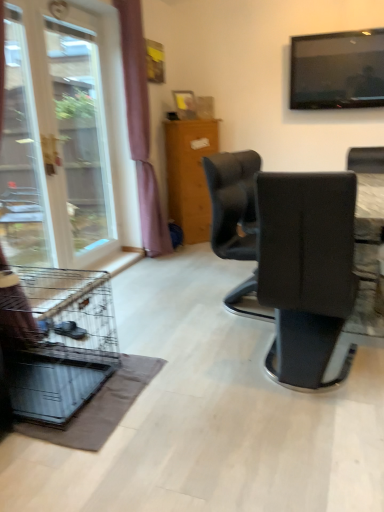
Find the location of `wooden cabinet at center`. wooden cabinet at center is located at coordinates click(x=190, y=175).

Image resolution: width=384 pixels, height=512 pixels. What do you see at coordinates (306, 270) in the screenshot?
I see `black leather chair at center` at bounding box center [306, 270].

Image resolution: width=384 pixels, height=512 pixels. I want to click on transparent glass screen door at left, so click(x=21, y=159).

This screenshot has width=384, height=512. What do you see at coordinates (21, 159) in the screenshot? I see `transparent glass screen door at left` at bounding box center [21, 159].

You are a GUI agent. You are given a task and a screenshot of the screen. Output one action in this format:
    pyautogui.click(x=<x>, y=<y>)
    Task: Click on the transparent glass window at left
    
    Given the screenshot: What is the action you would take?
    pyautogui.click(x=58, y=141)

Where is `purple fabric curtain at left`? purple fabric curtain at left is located at coordinates (141, 128).

What do you see at coordinates (141, 128) in the screenshot? The width and height of the screenshot is (384, 512). I see `purple fabric curtain at left` at bounding box center [141, 128].

This screenshot has height=512, width=384. In order to click on wooden cabinet at center in this screenshot , I will do `click(190, 175)`.

Is wooden cabinet at center to the left or to the right of flat screen tv at upper right in the image?

Based on their positions, wooden cabinet at center is located to the left of flat screen tv at upper right.

In the scene shown: Considering their positions, is wooden cabinet at center located in front of or behind flat screen tv at upper right?

Visually, wooden cabinet at center is located behind flat screen tv at upper right.

From a real-world perspective, is wooden cabinet at center positioned over flat screen tv at upper right based on gravity?

No, from a real-world perspective, wooden cabinet at center is not on top of flat screen tv at upper right.

Would you consider transparent glass window at left to be distant from black leather chair at center?

That's right, there is a large distance between transparent glass window at left and black leather chair at center.

Is transparent glass window at left not within black leather chair at center?

Yes.

Which point is more forward, (95, 217) or (277, 207)?

Positioned in front is point (277, 207).

Between transparent glass window at left and black leather chair at center, which one is positioned behind?

transparent glass window at left is further from the camera.

From a real-world perspective, which is physically below, metallic wire birdcage at lower left or flat screen tv at upper right?

metallic wire birdcage at lower left, from a real-world perspective.

From the image's perspective, between metallic wire birdcage at lower left and flat screen tv at upper right, which one is located above?

flat screen tv at upper right appears higher in the image.

Considering the points (72, 390) and (317, 78), which point is behind, point (72, 390) or point (317, 78)?

The point (317, 78) is farther from the camera.

Who is smaller, transparent glass screen door at left or wooden cabinet at center?

transparent glass screen door at left is smaller.

Considering the sizes of objects transparent glass screen door at left and wooden cabinet at center in the image provided, who is thinner, transparent glass screen door at left or wooden cabinet at center?

With smaller width is transparent glass screen door at left.

Is point (17, 67) less distant than point (180, 146)?

Yes, point (17, 67) is closer to viewer.

The height and width of the screenshot is (512, 384). Find the location of `furniture that is above the transparent glass screen door at left (from the image's perspective)`. furniture that is above the transparent glass screen door at left (from the image's perspective) is located at coordinates (190, 175).

Locate an element on the screen. television that is above the transparent glass window at left (from a real-world perspective) is located at coordinates (337, 70).

From a real-world perspective, who is located higher, flat screen tv at upper right or transparent glass window at left?

flat screen tv at upper right, from a real-world perspective.

Are flat screen tv at upper right and transparent glass window at left far apart?

flat screen tv at upper right is far away from transparent glass window at left.

Who is smaller, flat screen tv at upper right or transparent glass window at left?

With smaller size is flat screen tv at upper right.

Looking at this image, is metallic wire birdcage at lower left facing away from transparent glass screen door at left?

That's not correct — metallic wire birdcage at lower left is not looking away from transparent glass screen door at left.

From the picture: Considering the relative sizes of metallic wire birdcage at lower left and transparent glass screen door at left in the image provided, is metallic wire birdcage at lower left smaller than transparent glass screen door at left?

Answer: No, metallic wire birdcage at lower left is not smaller than transparent glass screen door at left.

From the image's perspective, is metallic wire birdcage at lower left above or below transparent glass screen door at left?

From the image's perspective, metallic wire birdcage at lower left appears below transparent glass screen door at left.

Looking at this image, is metallic wire birdcage at lower left further to camera compared to transparent glass screen door at left?

No, metallic wire birdcage at lower left is in front of transparent glass screen door at left.

From the image's perspective, is transparent glass window at left located beneath wooden cabinet at center?

No, from the image's perspective, transparent glass window at left is not beneath wooden cabinet at center.

Is point (106, 222) closer to viewer compared to point (169, 184)?

Yes, it is.

Considering the relative sizes of transparent glass window at left and wooden cabinet at center in the image provided, is transparent glass window at left bigger than wooden cabinet at center?

Incorrect, transparent glass window at left is not larger than wooden cabinet at center.

This screenshot has width=384, height=512. I want to click on television in front of the wooden cabinet at center, so click(337, 70).

Locate an element on the screen. This screenshot has height=512, width=384. chair below the transparent glass window at left (from the image's perspective) is located at coordinates (306, 270).

Considering their positions, is metallic wire birdcage at lower left positioned further to purple fabric curtain at left than flat screen tv at upper right?

metallic wire birdcage at lower left lies further to purple fabric curtain at left than the other object.

Estimate the real-world distances between objects in this image. Which object is closer to purple fabric curtain at left, transparent glass window at left or metallic wire birdcage at lower left?

transparent glass window at left is positioned closer to the anchor purple fabric curtain at left.

Looking at the image, which one is located further to flat screen tv at upper right, black leather chair at center or purple fabric curtain at left?

The object further to flat screen tv at upper right is black leather chair at center.

In the scene shown: Based on their spatial positions, is transparent glass window at left or wooden cabinet at center further from metallic wire birdcage at lower left?

wooden cabinet at center is further to metallic wire birdcage at lower left.

When comparing their distances from wooden cabinet at center, does black leather chair at center or transparent glass screen door at left seem further?

Based on the image, black leather chair at center appears to be further to wooden cabinet at center.

Estimate the real-world distances between objects in this image. Which object is further from purple fabric curtain at left, transparent glass screen door at left or flat screen tv at upper right?

Based on the image, flat screen tv at upper right appears to be further to purple fabric curtain at left.

Considering their positions, is metallic wire birdcage at lower left positioned further to purple fabric curtain at left than transparent glass screen door at left?

Among the two, metallic wire birdcage at lower left is located further to purple fabric curtain at left.

Looking at the image, which one is located further to metallic wire birdcage at lower left, black leather chair at center or transparent glass screen door at left?

Based on the image, black leather chair at center appears to be further to metallic wire birdcage at lower left.

Where is `window located between metallic wire birdcage at lower left and purple fabric curtain at left in the depth direction`? This screenshot has width=384, height=512. window located between metallic wire birdcage at lower left and purple fabric curtain at left in the depth direction is located at coordinates (58, 141).

The width and height of the screenshot is (384, 512). I want to click on screen door between black leather chair at center and wooden cabinet at center in the front-back direction, so click(21, 159).

This screenshot has width=384, height=512. Find the location of `bird cage between transparent glass screen door at left and flat screen tv at upper right from left to right`. bird cage between transparent glass screen door at left and flat screen tv at upper right from left to right is located at coordinates (56, 340).

You are a GUI agent. You are given a task and a screenshot of the screen. Output one action in this format:
    pyautogui.click(x=<x>, y=<y>)
    Task: Click on the curtain located between black leather chair at center and wooden cabinet at center in the depth direction
    Image resolution: width=384 pixels, height=512 pixels.
    Given the screenshot: What is the action you would take?
    pyautogui.click(x=141, y=128)